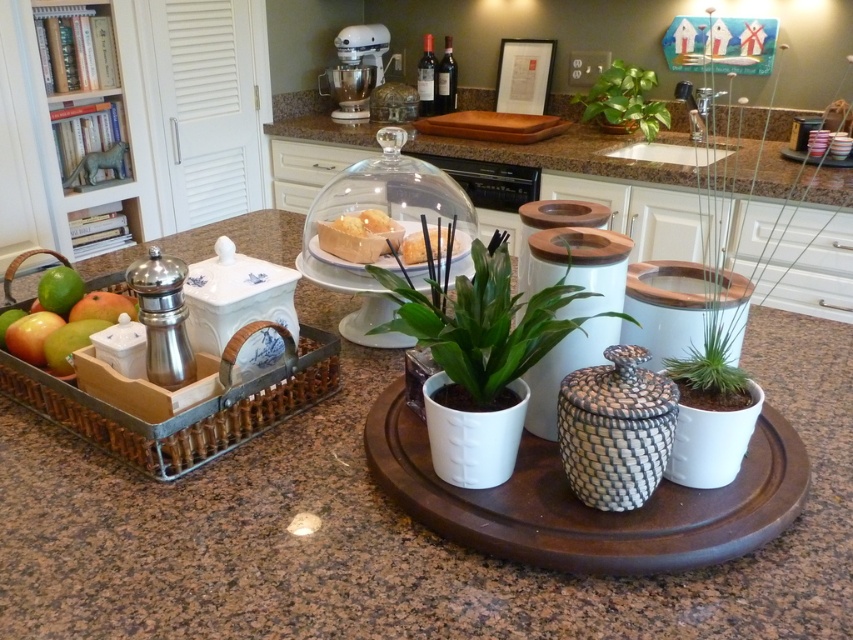
Question: Estimate the real-world distances between objects in this image. Which object is farther from the green glossy plant at upper right?

Choices:
 (A) green matte plant at center
 (B) yellow sponge cake at center
 (C) translucent glass bread at center
 (D) brown granite tray at center

Answer: (A)

Question: Considering the relative positions of wooden tray at left and translucent glass bread at center in the image provided, where is wooden tray at left located with respect to translucent glass bread at center?

Choices:
 (A) above
 (B) below

Answer: (B)

Question: Which object appears farthest from the camera in this image?

Choices:
 (A) green glossy plant at upper right
 (B) green matte plant at center
 (C) translucent glass bread at center

Answer: (A)

Question: Which point is farther to the camera?

Choices:
 (A) (402, 260)
 (B) (360, 227)

Answer: (B)

Question: Is brown granite tray at center closer to the viewer compared to yellow sponge cake at center?

Choices:
 (A) no
 (B) yes

Answer: (B)

Question: Can you confirm if brown granite tray at center is positioned to the left of translucent glass bread at center?

Choices:
 (A) no
 (B) yes

Answer: (B)